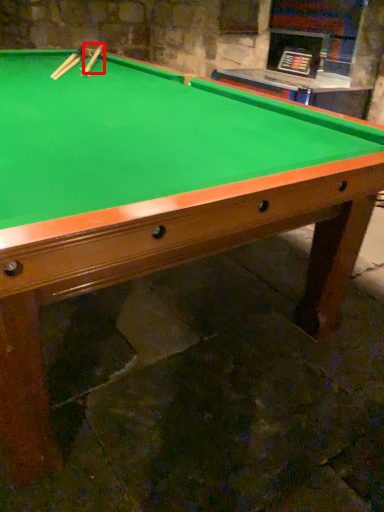
Question: From the image, what is the correct spatial relationship of cue (annotated by the red box) in relation to cue?

Choices:
 (A) right
 (B) left

Answer: (A)